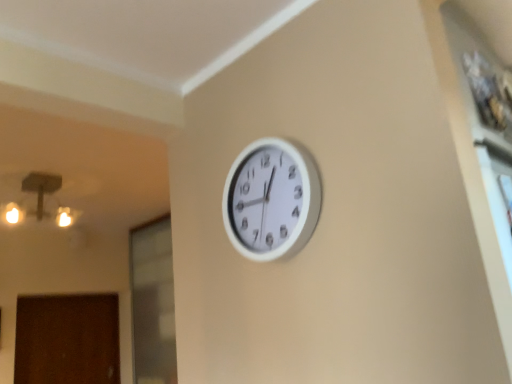
Question: From the image's perspective, is brown matte door at lower left located above or below white plastic clock at upper center?

Choices:
 (A) above
 (B) below

Answer: (B)

Question: From a real-world perspective, is brown matte door at lower left positioned above or below white plastic clock at upper center?

Choices:
 (A) above
 (B) below

Answer: (B)

Question: Which is farther from the brown matte door at lower left?

Choices:
 (A) transparent glass door at lower left
 (B) white plastic clock at upper center

Answer: (B)

Question: Considering the real-world distances, which object is closest to the transparent glass door at lower left?

Choices:
 (A) brown matte door at lower left
 (B) white plastic clock at upper center

Answer: (A)